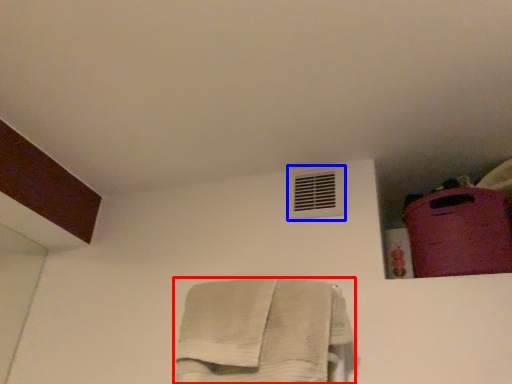
Question: Which object is further to the camera taking this photo, towel (highlighted by a red box) or air conditioning (highlighted by a blue box)?

Choices:
 (A) towel
 (B) air conditioning

Answer: (B)